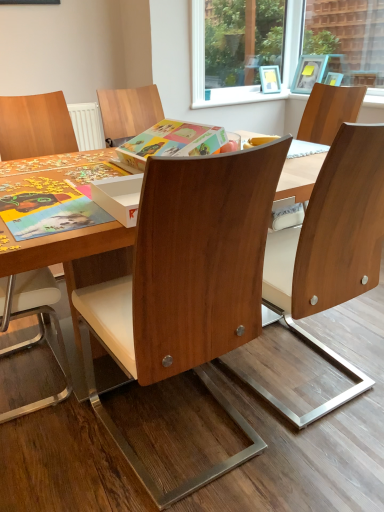
Question: Is wooden chair at center, the 2th chair in the left-to-right sequence, not near wooden chair at center, acting as the 3th chair starting from the left?

Choices:
 (A) no
 (B) yes

Answer: (A)

Question: Is wooden chair at center, the 2th chair in the left-to-right sequence, completely or partially outside of wooden chair at center, the first chair viewed from the right?

Choices:
 (A) no
 (B) yes

Answer: (B)

Question: Can you confirm if wooden chair at center, arranged as the second chair when viewed from the right, is taller than wooden chair at center, acting as the 3th chair starting from the left?

Choices:
 (A) no
 (B) yes

Answer: (B)

Question: Does wooden chair at center, the 2th chair in the left-to-right sequence, have a larger size compared to wooden chair at center, the first chair viewed from the right?

Choices:
 (A) no
 (B) yes

Answer: (B)

Question: Is wooden chair at center, the 2th chair in the left-to-right sequence, closer to camera compared to wooden chair at center, acting as the 3th chair starting from the left?

Choices:
 (A) no
 (B) yes

Answer: (B)

Question: Is wooden chair at center, arranged as the second chair when viewed from the right, facing towards wooden chair at center, the first chair viewed from the right?

Choices:
 (A) yes
 (B) no

Answer: (B)

Question: Are wooden chair at center, arranged as the second chair when viewed from the right, and matte cardboard book at center located far from each other?

Choices:
 (A) yes
 (B) no

Answer: (B)

Question: From a real-world perspective, is wooden chair at center, arranged as the second chair when viewed from the right, on top of matte cardboard book at center?

Choices:
 (A) yes
 (B) no

Answer: (B)

Question: Would you say wooden chair at center, the 2th chair in the left-to-right sequence, contains matte cardboard book at center?

Choices:
 (A) yes
 (B) no

Answer: (B)

Question: Is the depth of wooden chair at center, the 2th chair in the left-to-right sequence, greater than that of matte cardboard book at center?

Choices:
 (A) yes
 (B) no

Answer: (B)

Question: Could you tell me if wooden chair at center, arranged as the second chair when viewed from the right, is facing matte cardboard book at center?

Choices:
 (A) no
 (B) yes

Answer: (A)

Question: Considering the relative sizes of wooden chair at center, the 2th chair in the left-to-right sequence, and matte cardboard book at center in the image provided, is wooden chair at center, the 2th chair in the left-to-right sequence, smaller than matte cardboard book at center?

Choices:
 (A) no
 (B) yes

Answer: (A)

Question: From a real-world perspective, is wooden chair at left, which is the 3th chair in right-to-left order, physically below wooden chair at center, the first chair viewed from the right?

Choices:
 (A) no
 (B) yes

Answer: (B)